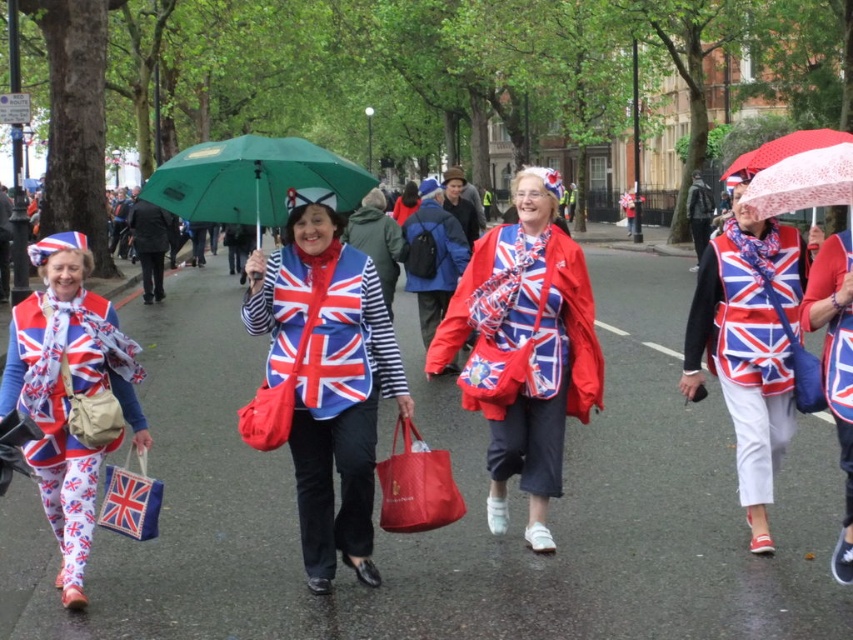
You are a photographer trying to capture the matte fabric jacket at center and the red lace umbrella at upper right in the same frame. Based on their positions, can you tell which object is closer to the camera?

The matte fabric jacket at center is located below the red lace umbrella at upper right, which means the red lace umbrella at upper right is closer to the camera than the matte fabric jacket at center.